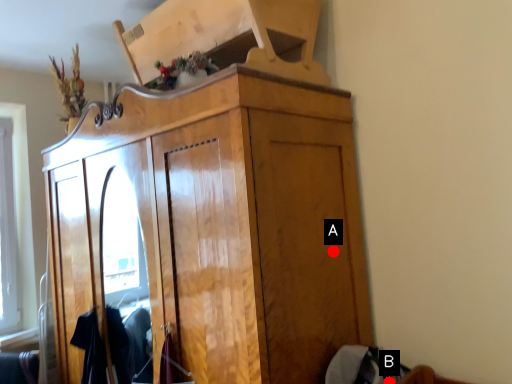
Question: Two points are circled on the image, labeled by A and B beside each circle. Which point is closer to the camera taking this photo?

Choices:
 (A) A is closer
 (B) B is closer

Answer: (B)